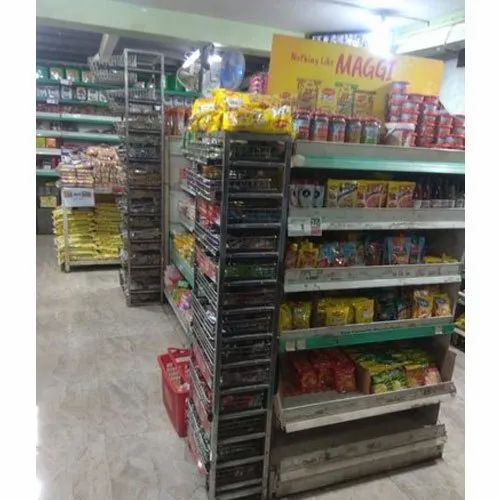
Identify the location of basket. The image size is (500, 500). (174, 390).